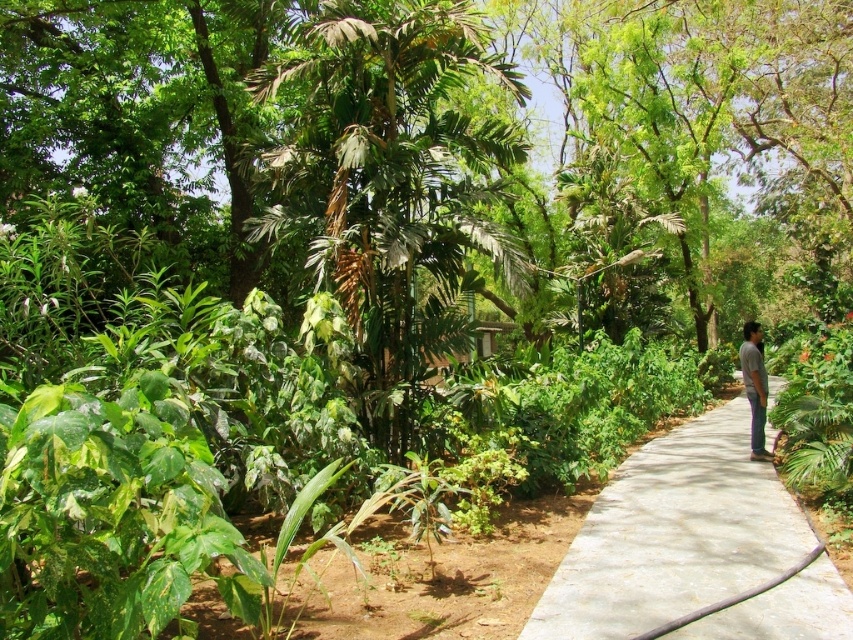
In the scene shown: You are a gardener planning to plant a new tree in the tropical garden. You see the green leafy tree at center and the gray cotton shirt at right. Which object is smaller in size?

The green leafy tree at center is smaller than the gray cotton shirt at right.

You are a gardener planning to plant a new tree in the tropical garden. You see the green leafy tree at center and the gray cotton shirt at right. Which object is taller, and why?

The gray cotton shirt at right is taller than the green leafy tree at center because the description states that the green leafy tree at center is shorter than the gray cotton shirt at right.

You are standing at the entrance of the garden and see the green leafy tree at center. If you want to reach the tree, which direction should you walk relative to the path?

The green leafy tree at center is located at coordinates (387,182), which is directly ahead along the path. Walk straight ahead along the path to reach it.